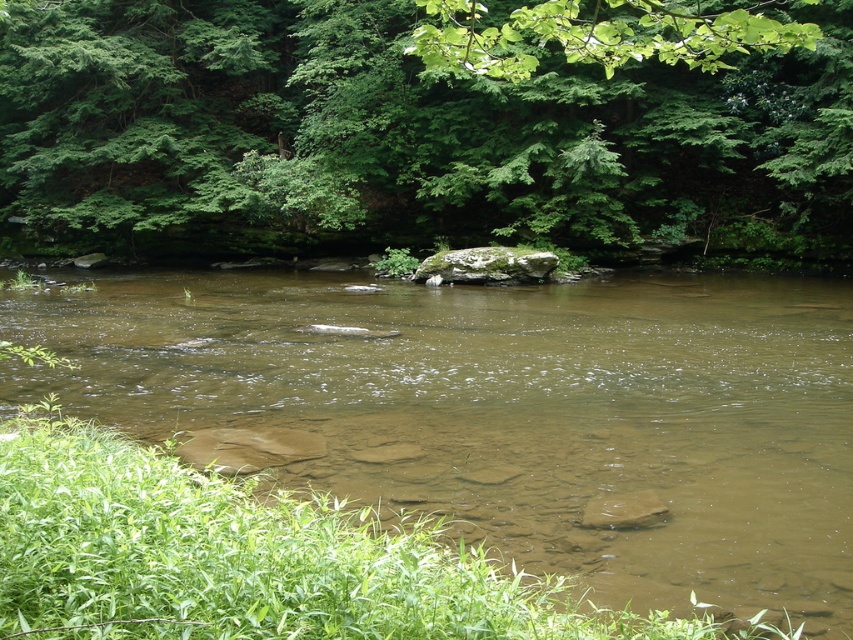
Question: Is green leafy tree at upper center below brown/muddy water at center?

Choices:
 (A) yes
 (B) no

Answer: (B)

Question: Among these objects, which one is nearest to the camera?

Choices:
 (A) brown/muddy water at center
 (B) green leafy tree at upper center

Answer: (A)

Question: Is green leafy tree at upper center behind brown/muddy water at center?

Choices:
 (A) yes
 (B) no

Answer: (A)

Question: Which of the following is the closest to the observer?

Choices:
 (A) brown/muddy water at center
 (B) green leafy tree at upper center

Answer: (A)

Question: Which object appears closest to the camera in this image?

Choices:
 (A) brown/muddy water at center
 (B) green leafy tree at upper center

Answer: (A)

Question: Can you confirm if green leafy tree at upper center is bigger than brown/muddy water at center?

Choices:
 (A) no
 (B) yes

Answer: (B)